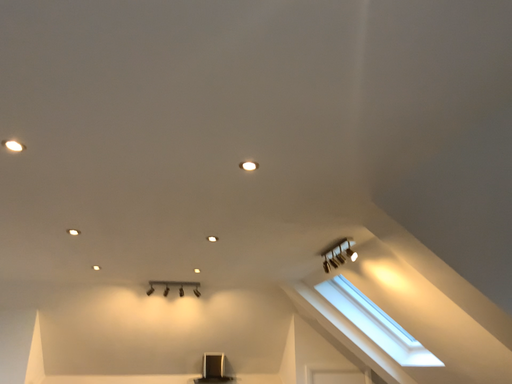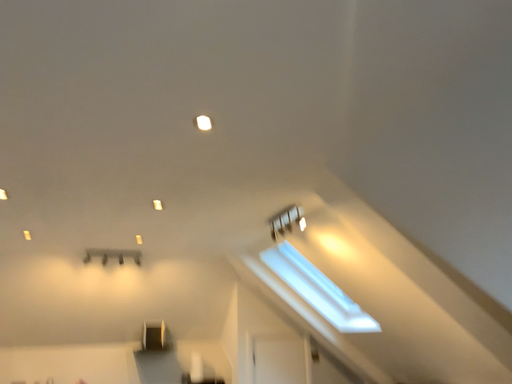
Question: How did the camera likely rotate when shooting the video?

Choices:
 (A) rotated right
 (B) rotated left

Answer: (A)